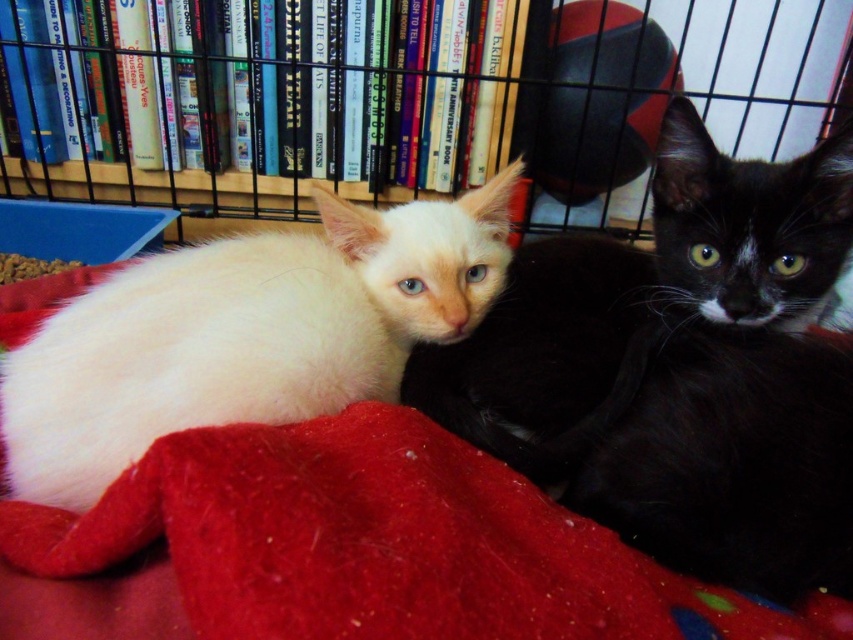
You are a pet owner who wants to ensure the white fur cat at center has enough space to move comfortably on the fuzzy red blanket at center. Based on the scene description, can you confirm if the blanket is large enough for the cat?

The white fur cat at center has a larger size compared to the fuzzy red blanket at center, so the blanket may not be large enough to accommodate the cat comfortably.

You are a visitor at an animal shelter and see the white fur cat at center and the wooden bookshelf at upper center in the enclosure. Which object is positioned to the right side of the other?

The white fur cat at center is to the right of the wooden bookshelf at upper center.